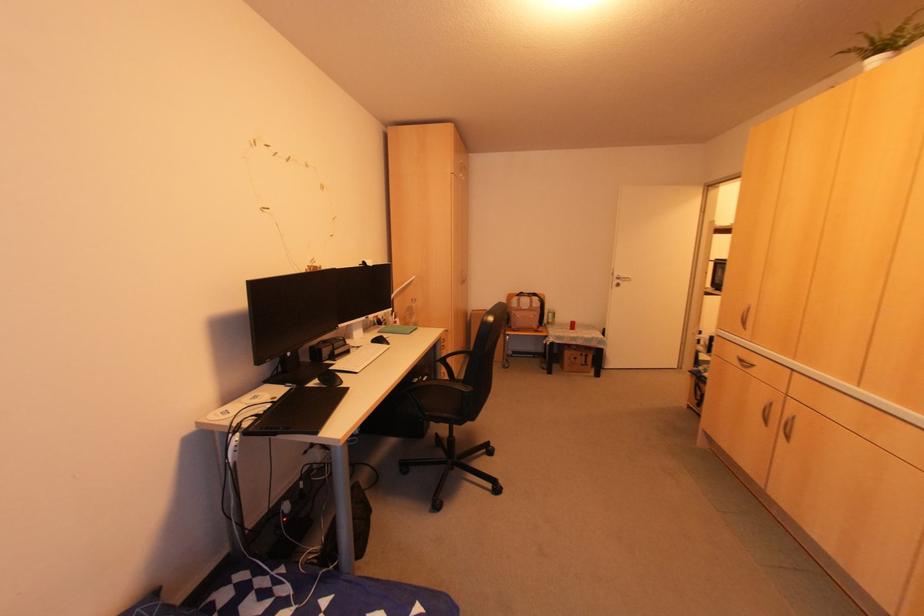
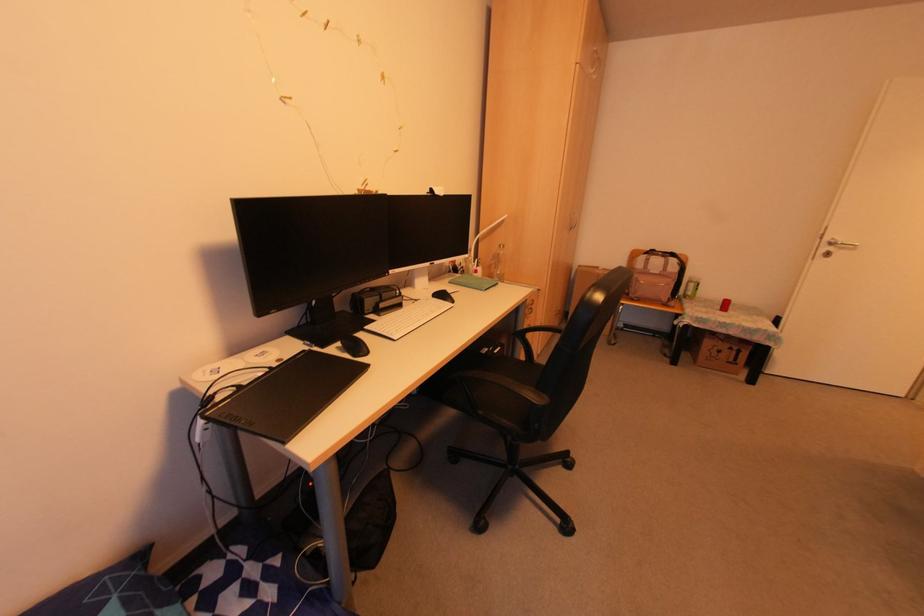
The point at [468,387] is marked in the first image. Where is the corresponding point in the second image?

(541, 397)